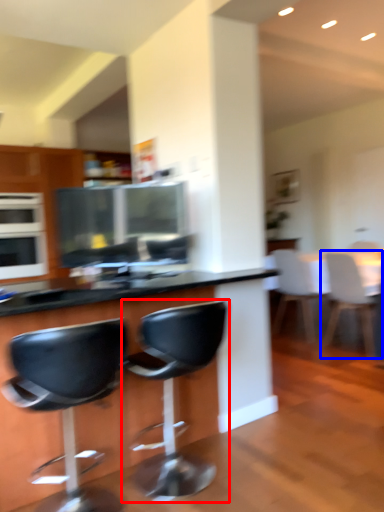
Question: Which object is closer to the camera taking this photo, chair (highlighted by a red box) or chair (highlighted by a blue box)?

Choices:
 (A) chair
 (B) chair

Answer: (A)